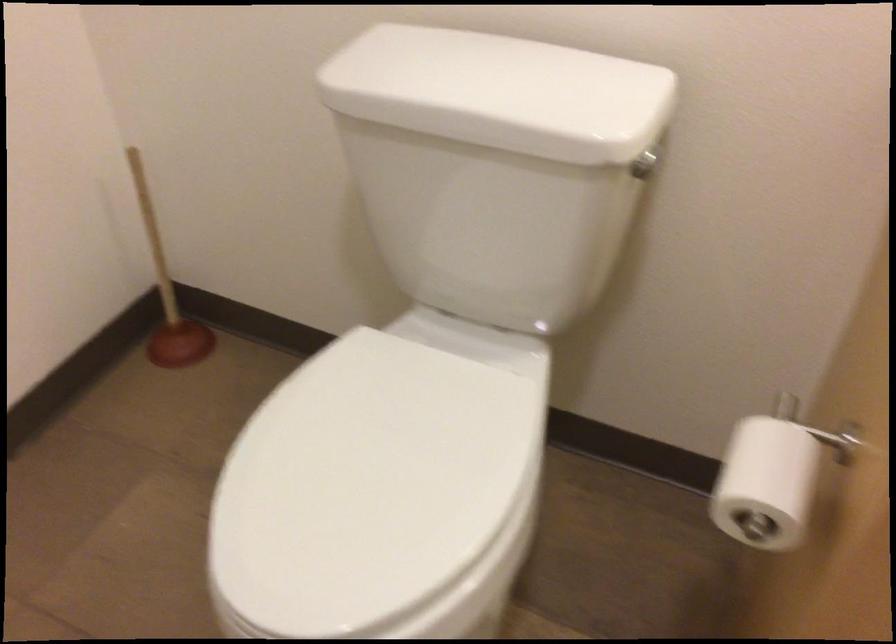
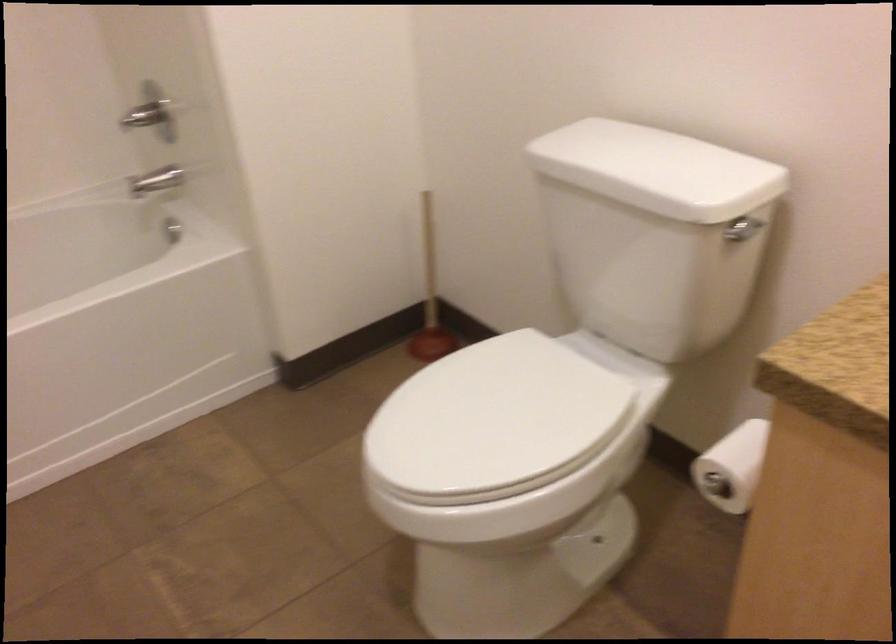
In a continuous first-person perspective shot, in which direction is the camera moving?

The cameraman walked toward right, backward.